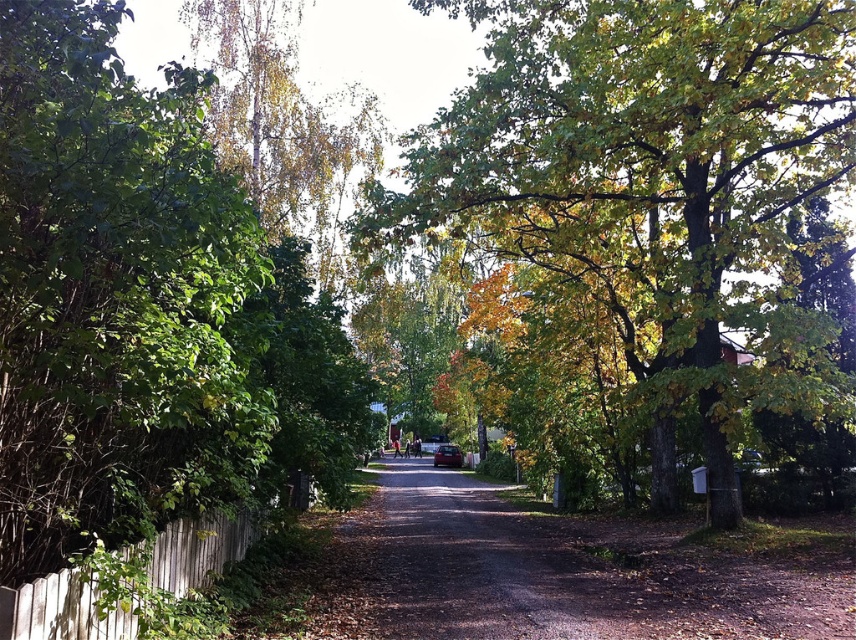
Question: Does green leafy tree at left appear under metallic silver car at center?

Choices:
 (A) yes
 (B) no

Answer: (B)

Question: Does green leafy tree at left have a lesser width compared to green leafy tree at center?

Choices:
 (A) yes
 (B) no

Answer: (A)

Question: Can you confirm if green leafy tree at center is positioned to the left of metallic silver car at center?

Choices:
 (A) no
 (B) yes

Answer: (A)

Question: Among these points, which one is farthest from the camera?

Choices:
 (A) (43, 605)
 (B) (131, 273)
 (C) (703, 394)

Answer: (C)

Question: Which of these objects is positioned farthest from the green leafy tree at center?

Choices:
 (A) white wooden fence at lower left
 (B) green leafy tree at left
 (C) metallic silver car at center

Answer: (C)

Question: Among these objects, which one is farthest from the camera?

Choices:
 (A) metallic silver car at center
 (B) white wooden fence at lower left
 (C) green leafy tree at center
 (D) green leafy tree at left

Answer: (A)